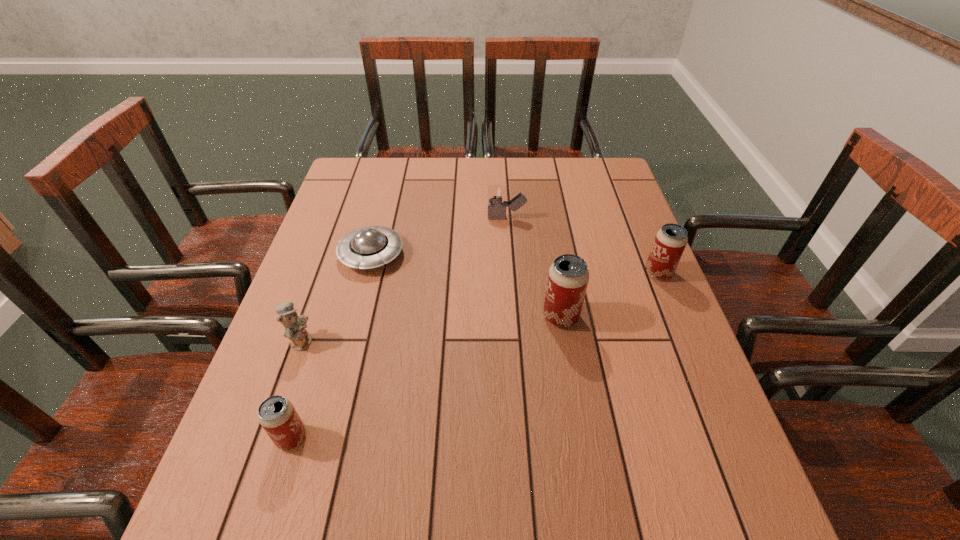
This screenshot has height=540, width=960. I want to click on object located in the right edge section of the desktop, so click(670, 241).

The height and width of the screenshot is (540, 960). I want to click on object present at the near left corner, so click(276, 414).

In the image, there is a desktop. Identify the location of free region at the far edge. (x=474, y=170).

Find the location of a particular element. free region at the near edge of the desktop is located at coordinates (396, 447).

Locate an element on the screen. The width and height of the screenshot is (960, 540). blank space at the left edge of the desktop is located at coordinates (284, 347).

You are a GUI agent. You are given a task and a screenshot of the screen. Output one action in this format:
    pyautogui.click(x=<x>, y=<y>)
    Task: Click on the vacant point at the right edge
    This screenshot has height=540, width=960.
    Given the screenshot: What is the action you would take?
    pyautogui.click(x=594, y=225)

Locate an element on the screen. free location at the far left corner of the desktop is located at coordinates (392, 165).

Where is `vacant space at the near right corner`? The width and height of the screenshot is (960, 540). vacant space at the near right corner is located at coordinates (668, 424).

Where is `free space between the fifth shortest object and the third object from right to left`? The width and height of the screenshot is (960, 540). free space between the fifth shortest object and the third object from right to left is located at coordinates (583, 245).

Identify the location of unoccupied position between the teddy bear and the farthest beer can. This screenshot has width=960, height=540. (480, 307).